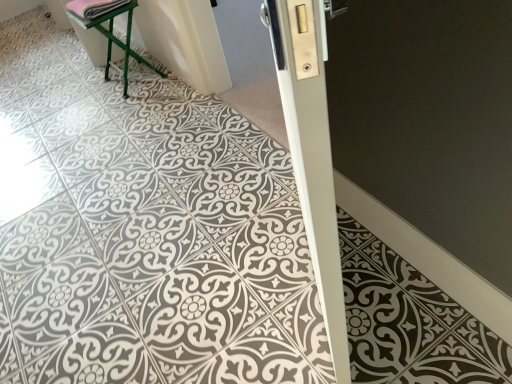
This screenshot has width=512, height=384. What do you see at coordinates (114, 37) in the screenshot?
I see `green metal stool at upper left` at bounding box center [114, 37].

Where is `green metal stool at upper left`? This screenshot has width=512, height=384. green metal stool at upper left is located at coordinates (114, 37).

Identify the location of white glossy door at center. The image size is (512, 384). (311, 152).

From their relative heights in the image, would you say green metal stool at upper left is taller or shorter than white glossy door at center?

Clearly, green metal stool at upper left is shorter compared to white glossy door at center.

From the picture: Can you tell me how much green metal stool at upper left and white glossy door at center differ in facing direction?

32.9 degrees separate the facing orientations of green metal stool at upper left and white glossy door at center.

Is green metal stool at upper left to the left or to the right of white glossy door at center in the image?

Clearly, green metal stool at upper left is on the left of white glossy door at center in the image.

Is white glossy door at center at the back of green metal stool at upper left?

No.

Is pink fabric at upper left touching green metal stool at upper left?

No, pink fabric at upper left is not beside green metal stool at upper left.

Considering the points (69, 5) and (100, 20), which point is in front, point (69, 5) or point (100, 20)?

The point (100, 20) is closer to the camera.

In the scene shown: Considering the positions of objects pink fabric at upper left and green metal stool at upper left in the image provided, who is more to the left, pink fabric at upper left or green metal stool at upper left?

Positioned to the left is pink fabric at upper left.

Considering the relative sizes of pink fabric at upper left and green metal stool at upper left in the image provided, is pink fabric at upper left thinner than green metal stool at upper left?

Yes.

Consider the image. Can you tell me how much green metal stool at upper left and pink fabric at upper left differ in facing direction?

The facing directions of green metal stool at upper left and pink fabric at upper left are 0.000611 degrees apart.

Considering the relative sizes of green metal stool at upper left and pink fabric at upper left in the image provided, is green metal stool at upper left taller than pink fabric at upper left?

Correct, green metal stool at upper left is much taller as pink fabric at upper left.

Is green metal stool at upper left facing away from pink fabric at upper left?

No.

Which object is further away from the camera, green metal stool at upper left or pink fabric at upper left?

green metal stool at upper left is further from the camera.

Can you tell me how much white glossy door at center and pink fabric at upper left differ in facing direction?

white glossy door at center and pink fabric at upper left are facing 32.9 degrees away from each other.

Does white glossy door at center have a larger size compared to pink fabric at upper left?

Yes, white glossy door at center is bigger than pink fabric at upper left.

Could you tell me if white glossy door at center is facing pink fabric at upper left?

No, white glossy door at center is not oriented towards pink fabric at upper left.

Which object is closer to the camera, white glossy door at center or pink fabric at upper left?

white glossy door at center is more forward.

Is point (102, 8) positioned before point (302, 167)?

No, it is behind (302, 167).

Consider the image. How distant is pink fabric at upper left from white glossy door at center?

pink fabric at upper left and white glossy door at center are 1.62 meters apart from each other.

From a real-world perspective, between pink fabric at upper left and white glossy door at center, who is vertically higher?

white glossy door at center is physically above.

The height and width of the screenshot is (384, 512). I want to click on material that is above the white glossy door at center (from the image's perspective), so coord(94,7).

From the image's perspective, is white glossy door at center on top of green metal stool at upper left?

No, from the image's perspective, white glossy door at center is not over green metal stool at upper left.

Relative to green metal stool at upper left, is white glossy door at center in front or behind?

Clearly, white glossy door at center is in front of green metal stool at upper left.

From a real-world perspective, which object rests below the other?

green metal stool at upper left.

The width and height of the screenshot is (512, 384). Identify the location of furniture directly beneath the white glossy door at center (from a real-world perspective). (114, 37).

You are a GUI agent. You are given a task and a screenshot of the screen. Output one action in this format:
    pyautogui.click(x=<x>, y=<y>)
    Task: Click on the material above the green metal stool at upper left (from the image's perspective)
    Image resolution: width=512 pixels, height=384 pixels.
    Given the screenshot: What is the action you would take?
    pyautogui.click(x=94, y=7)

In the scene shown: When comparing their distances from green metal stool at upper left, does white glossy door at center or pink fabric at upper left seem further?

white glossy door at center is further to green metal stool at upper left.

Based on their spatial positions, is pink fabric at upper left or green metal stool at upper left further from white glossy door at center?

pink fabric at upper left is further to white glossy door at center.

Consider the image. Estimate the real-world distances between objects in this image. Which object is closer to pink fabric at upper left, white glossy door at center or green metal stool at upper left?

Among the two, green metal stool at upper left is located nearer to pink fabric at upper left.

Consider the image. Considering their positions, is green metal stool at upper left positioned closer to pink fabric at upper left than white glossy door at center?

green metal stool at upper left is closer to pink fabric at upper left.

Considering their positions, is pink fabric at upper left positioned further to green metal stool at upper left than white glossy door at center?

Among the two, white glossy door at center is located further to green metal stool at upper left.

From the image, which object appears to be farther from white glossy door at center, green metal stool at upper left or pink fabric at upper left?

The object further to white glossy door at center is pink fabric at upper left.

The width and height of the screenshot is (512, 384). I want to click on material positioned between white glossy door at center and green metal stool at upper left from near to far, so click(x=94, y=7).